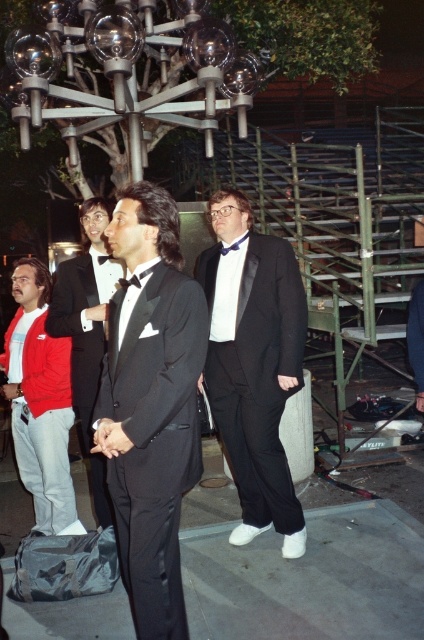
Does black satin tuxedo at center have a smaller size compared to shiny black tuxedo at center?

Indeed, black satin tuxedo at center has a smaller size compared to shiny black tuxedo at center.

Who is more distant from viewer, (181, 305) or (89, 410)?

The point (89, 410) is behind.

Between point (194, 282) and point (102, 522), which one is positioned in front?

Point (194, 282) is in front.

The width and height of the screenshot is (424, 640). In order to click on black satin tuxedo at center in this screenshot , I will do `click(150, 403)`.

Is black satin tuxedo at center thinner than matte black suit at center?

Yes, black satin tuxedo at center is thinner than matte black suit at center.

Does point (172, 364) come farther from viewer compared to point (286, 490)?

That is False.

Is point (156, 365) farther from viewer compared to point (223, 227)?

No, it is in front of (223, 227).

I want to click on black satin tuxedo at center, so click(150, 403).

This screenshot has width=424, height=640. What do you see at coordinates (253, 364) in the screenshot? I see `matte black suit at center` at bounding box center [253, 364].

Between matte black suit at center and shiny black tuxedo at center, which one appears on the left side from the viewer's perspective?

From the viewer's perspective, shiny black tuxedo at center appears more on the left side.

What do you see at coordinates (253, 364) in the screenshot?
I see `matte black suit at center` at bounding box center [253, 364].

The width and height of the screenshot is (424, 640). In order to click on matte black suit at center in this screenshot , I will do `click(253, 364)`.